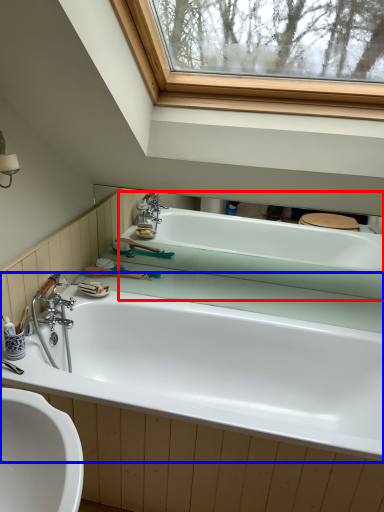
Question: Which object appears farthest to the camera in this image, bathtub (highlighted by a red box) or bathtub (highlighted by a blue box)?

Choices:
 (A) bathtub
 (B) bathtub

Answer: (A)